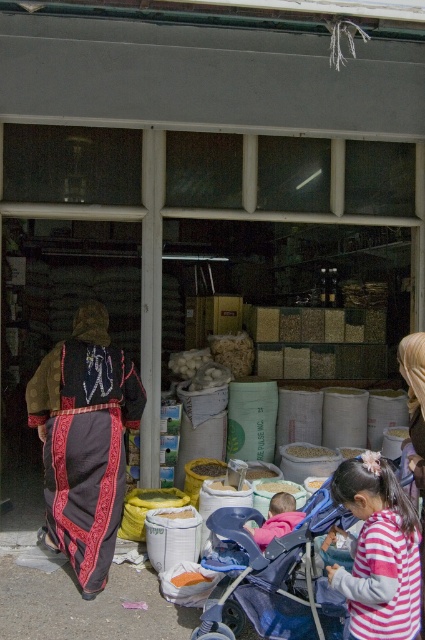
Is striped cotton shirt at center smaller than white matte rice at center?

Actually, striped cotton shirt at center might be larger than white matte rice at center.

Who is more forward, (382, 572) or (302, 452)?

Point (382, 572) is in front.

In order to click on striped cotton shirt at center in this screenshot , I will do click(379, 552).

Is point (102, 403) positioned in front of point (277, 529)?

No, (102, 403) is behind (277, 529).

You are a GUI agent. You are given a task and a screenshot of the screen. Output one action in this format:
    pyautogui.click(x=<x>, y=<y>)
    Task: Click on the dark brown fabric at left
    Image resolution: width=425 pixels, height=640 pixels.
    Given the screenshot: What is the action you would take?
    pyautogui.click(x=85, y=442)

Which is behind, point (88, 522) or point (294, 508)?

Positioned behind is point (294, 508).

Image resolution: width=425 pixels, height=640 pixels. Identify the location of dark brown fabric at left. (85, 442).

Is the position of pink fabric baby carriage at center less distant than that of white matte rice at center?

Yes, pink fabric baby carriage at center is in front of white matte rice at center.

How distant is pink fabric baby carriage at center from white matte rice at center?

pink fabric baby carriage at center is 4.34 feet from white matte rice at center.

Find the location of a particular element. Image resolution: width=425 pixels, height=640 pixels. pink fabric baby carriage at center is located at coordinates (277, 518).

Identify the location of pink fabric baby carriage at center. pos(277,518).